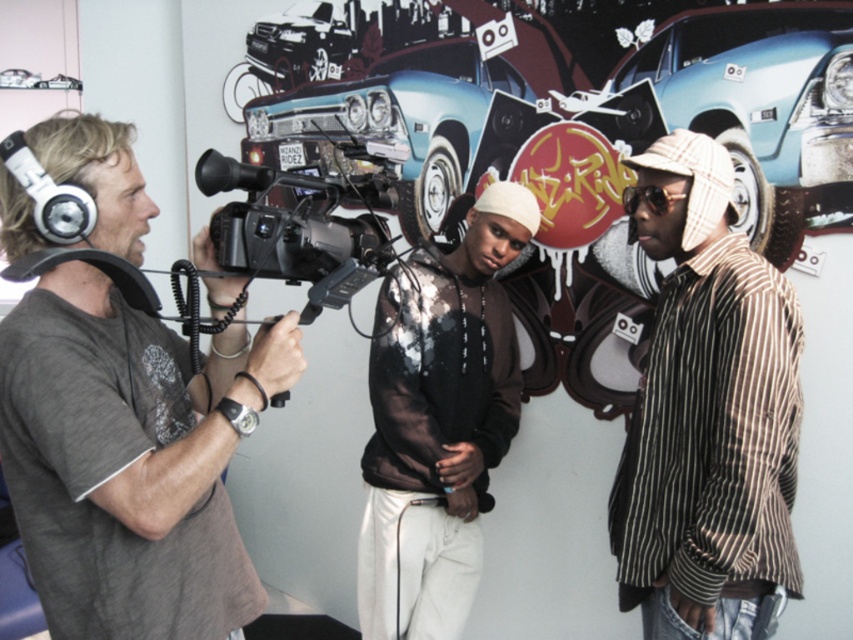
Can you confirm if striped cotton shirt at right is bigger than shiny blue car at center?

Actually, striped cotton shirt at right might be smaller than shiny blue car at center.

Looking at this image, does striped cotton shirt at right appear over shiny blue car at center?

Actually, striped cotton shirt at right is below shiny blue car at center.

What do you see at coordinates (706, 412) in the screenshot? The width and height of the screenshot is (853, 640). I see `striped cotton shirt at right` at bounding box center [706, 412].

Find the location of a particular element. striped cotton shirt at right is located at coordinates (706, 412).

Does gray cotton t-shirt at left have a greater width compared to light blue metallic car at upper right?

Incorrect, gray cotton t-shirt at left's width does not surpass light blue metallic car at upper right's.

Is gray cotton t-shirt at left bigger than light blue metallic car at upper right?

Yes.

Describe the element at coordinates (131, 460) in the screenshot. I see `gray cotton t-shirt at left` at that location.

Find the location of a particular element. This screenshot has height=640, width=853. gray cotton t-shirt at left is located at coordinates (131, 460).

Is black plastic video camera at center thinner than white matte headphones at left?

No, black plastic video camera at center is not thinner than white matte headphones at left.

Does black plastic video camera at center have a greater height compared to white matte headphones at left?

Yes, black plastic video camera at center is taller than white matte headphones at left.

Is point (289, 186) closer to viewer compared to point (9, 154)?

No, it is not.

Image resolution: width=853 pixels, height=640 pixels. I want to click on black plastic video camera at center, so pyautogui.click(x=305, y=225).